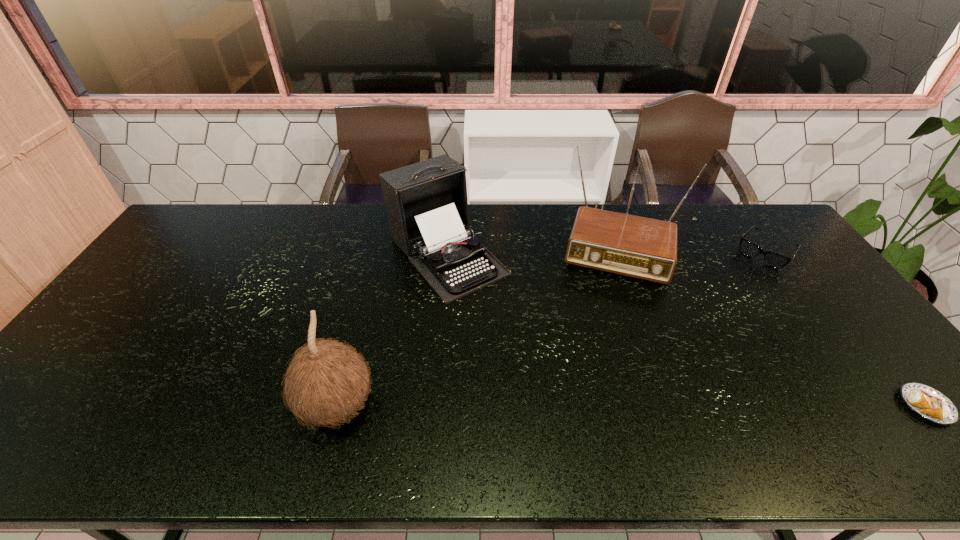
This screenshot has width=960, height=540. I want to click on coconut, so click(x=327, y=381).

Find the location of a particular element. typewriter is located at coordinates (426, 202).

Locate an element on the screen. sunglasses is located at coordinates (772, 259).

The width and height of the screenshot is (960, 540). Identify the location of radio_receiver. (639, 247).

Image resolution: width=960 pixels, height=540 pixels. What are the coordinates of `free spot located on the surface of the coconut` in the screenshot? It's located at (483, 406).

You are a GUI agent. You are given a task and a screenshot of the screen. Output one action in this format:
    pyautogui.click(x=<x>, y=<y>)
    Task: Click on the vacant region located inside the open case of the typewriter
    The image size is (960, 540).
    Given the screenshot: What is the action you would take?
    tap(559, 380)

Identify the location of vacant area situated 0.340m inside the open case of the typewriter. (556, 376).

This screenshot has height=540, width=960. What are the coordinates of `free space located 0.280m inside the open case of the typewriter` in the screenshot? It's located at (540, 360).

At what (x,y) coordinates should I click in order to perform the action: click on vacant point located on the front-facing side of the fourth tallest object. Please return your answer as a coordinate pair (x, y). Looking at the image, I should click on (747, 275).

At what (x,y) coordinates should I click in order to perform the action: click on vacant point located on the front-facing side of the fourth tallest object. Please return your answer as a coordinate pair (x, y). This screenshot has height=540, width=960. Looking at the image, I should click on (747, 275).